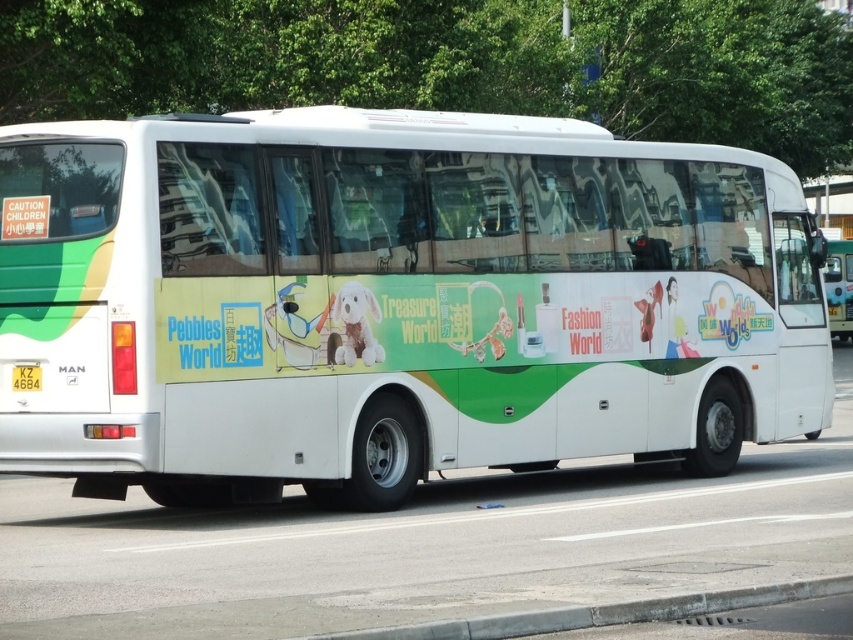
Does white glossy bus at right have a greater width compared to yellow plastic license plate at rear?

Yes, white glossy bus at right is wider than yellow plastic license plate at rear.

Which of these two, white glossy bus at right or yellow plastic license plate at rear, stands shorter?

With less height is yellow plastic license plate at rear.

Where is `white glossy bus at right`? The width and height of the screenshot is (853, 640). white glossy bus at right is located at coordinates [839, 288].

Locate an element on the screen. white glossy bus at right is located at coordinates (839, 288).

Does white glossy bus at center have a greater width compared to yellow plastic license plate at rear?

Yes.

Between point (550, 410) and point (39, 380), which one is positioned behind?

The point (550, 410) is more distant.

Where is `white glossy bus at center`? white glossy bus at center is located at coordinates (393, 301).

Consider the image. Can you confirm if white glossy bus at center is bigger than white glossy bus at right?

Actually, white glossy bus at center might be smaller than white glossy bus at right.

Who is more forward, (x=653, y=168) or (x=830, y=312)?

Point (x=653, y=168) is more forward.

The height and width of the screenshot is (640, 853). What do you see at coordinates (393, 301) in the screenshot?
I see `white glossy bus at center` at bounding box center [393, 301].

I want to click on white glossy bus at center, so click(x=393, y=301).